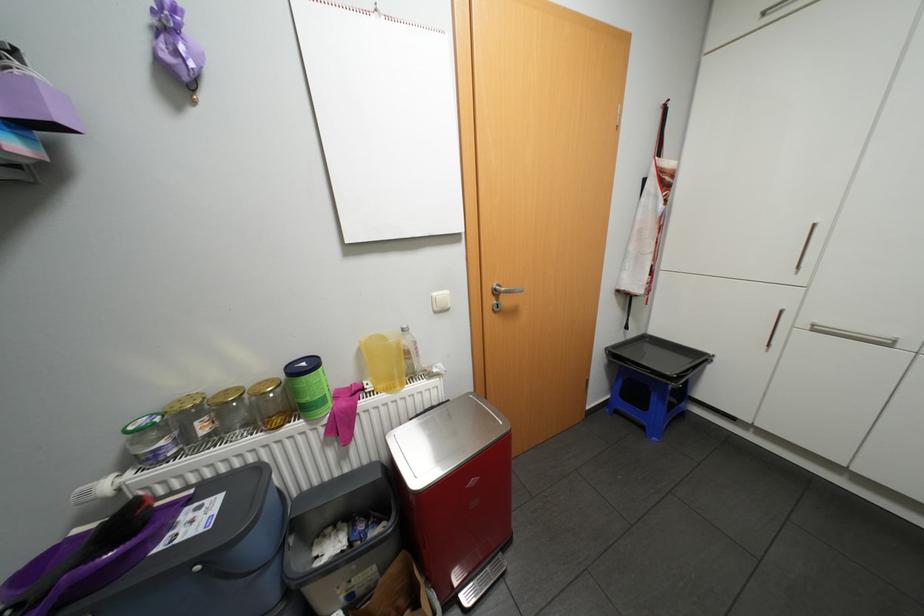
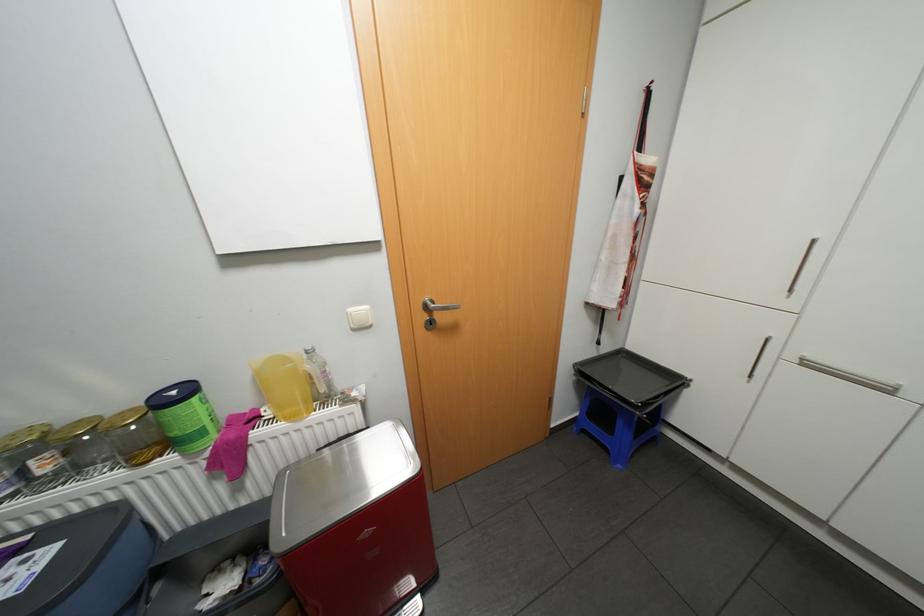
The point at (203, 422) is marked in the first image. Where is the corresponding point in the second image?

(39, 461)